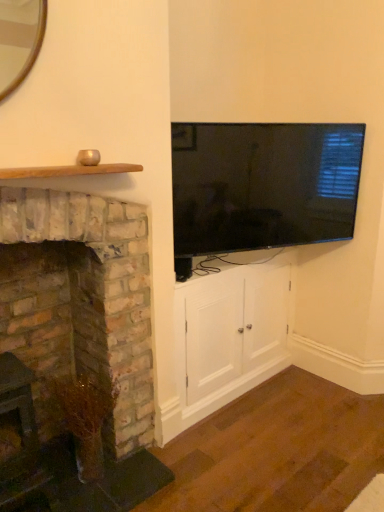
Question: Can you confirm if brick fireplace at left is positioned to the left of white wood cabinet at center?

Choices:
 (A) no
 (B) yes

Answer: (B)

Question: From a real-world perspective, is brick fireplace at left located beneath white wood cabinet at center?

Choices:
 (A) yes
 (B) no

Answer: (B)

Question: Can you confirm if brick fireplace at left is taller than white wood cabinet at center?

Choices:
 (A) no
 (B) yes

Answer: (B)

Question: From a real-world perspective, is brick fireplace at left located higher than white wood cabinet at center?

Choices:
 (A) no
 (B) yes

Answer: (B)

Question: Is brick fireplace at left shorter than white wood cabinet at center?

Choices:
 (A) yes
 (B) no

Answer: (B)

Question: Which is correct: brick fireplace at left is inside flat-screen tv at upper right, or outside of it?

Choices:
 (A) inside
 (B) outside

Answer: (B)

Question: Considering the positions of point (38, 306) and point (251, 159), is point (38, 306) closer or farther from the camera than point (251, 159)?

Choices:
 (A) farther
 (B) closer

Answer: (B)

Question: From the image's perspective, is brick fireplace at left above or below flat-screen tv at upper right?

Choices:
 (A) above
 (B) below

Answer: (B)

Question: From a real-world perspective, is brick fireplace at left above or below flat-screen tv at upper right?

Choices:
 (A) below
 (B) above

Answer: (A)

Question: Considering their positions, is flat-screen tv at upper right located in front of or behind white wood cabinet at center?

Choices:
 (A) front
 (B) behind

Answer: (A)

Question: Would you say flat-screen tv at upper right is to the left or to the right of white wood cabinet at center in the picture?

Choices:
 (A) left
 (B) right

Answer: (B)

Question: Is flat-screen tv at upper right taller or shorter than white wood cabinet at center?

Choices:
 (A) tall
 (B) short

Answer: (B)

Question: Considering the positions of point pos(249,216) and point pos(226,303), is point pos(249,216) closer or farther from the camera than point pos(226,303)?

Choices:
 (A) farther
 (B) closer

Answer: (B)

Question: From their relative heights in the image, would you say flat-screen tv at upper right is taller or shorter than brick fireplace at left?

Choices:
 (A) short
 (B) tall

Answer: (A)

Question: From the image's perspective, is flat-screen tv at upper right located above or below brick fireplace at left?

Choices:
 (A) below
 (B) above

Answer: (B)